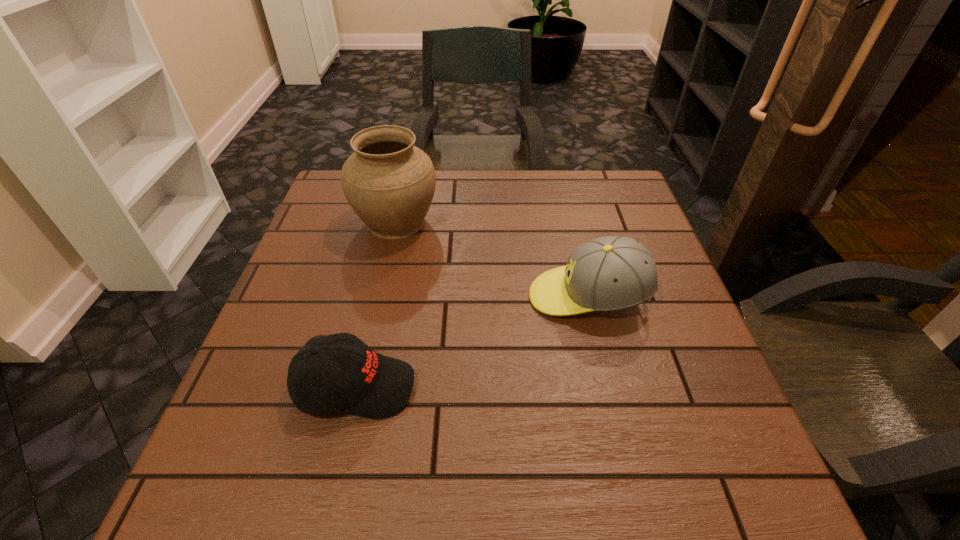
This screenshot has height=540, width=960. In the image, there is a desktop. Find the location of `blank space at the near right corner`. blank space at the near right corner is located at coordinates (743, 490).

Image resolution: width=960 pixels, height=540 pixels. Identify the location of free space between the left baseball cap and the tallest object. (376, 305).

The height and width of the screenshot is (540, 960). I want to click on empty space between the second nearest object and the tallest object, so click(492, 259).

Locate an element on the screen. Image resolution: width=960 pixels, height=540 pixels. empty location between the farthest object and the shorter baseball cap is located at coordinates (376, 305).

Image resolution: width=960 pixels, height=540 pixels. I want to click on free space between the tallest object and the nearer baseball cap, so click(x=376, y=305).

This screenshot has height=540, width=960. In order to click on blank region between the farthest object and the rightmost object in this screenshot , I will do `click(492, 259)`.

The height and width of the screenshot is (540, 960). I want to click on vacant space that's between the nearer baseball cap and the right baseball cap, so click(472, 342).

At what (x,y) coordinates should I click in order to perform the action: click on empty space that is in between the left baseball cap and the urn. Please return your answer as a coordinate pair (x, y). The width and height of the screenshot is (960, 540). Looking at the image, I should click on (376, 305).

Find the location of a particular element. free space between the tallest object and the shorter baseball cap is located at coordinates (376, 305).

This screenshot has height=540, width=960. In order to click on vacant area that lies between the nearer baseball cap and the farthest object in this screenshot , I will do `click(376, 305)`.